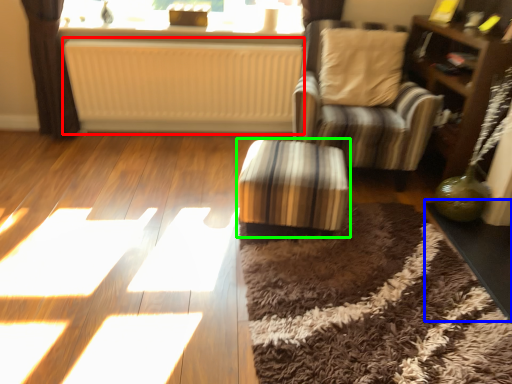
Question: Which object is the closest to the radiator (highlighted by a red box)? Choose among these: table (highlighted by a blue box) or table (highlighted by a green box).

Choices:
 (A) table
 (B) table

Answer: (B)